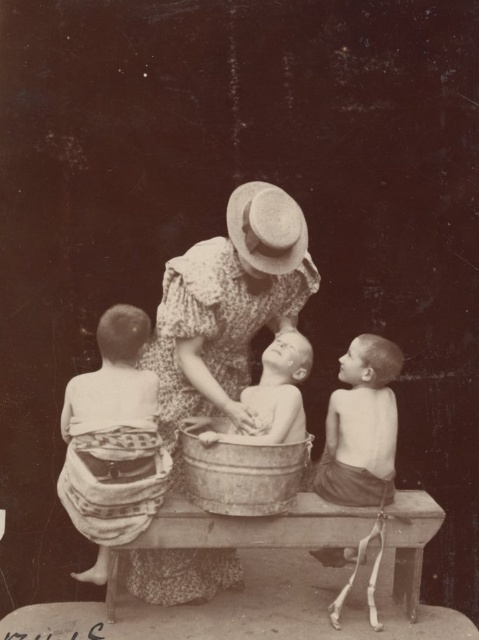
Question: Which point is farther from the camera taking this photo?

Choices:
 (A) (237, 243)
 (B) (254, 417)
 (C) (90, 476)

Answer: (A)

Question: Can you confirm if smooth skin boy at right is bigger than straw hat at center?

Choices:
 (A) no
 (B) yes

Answer: (B)

Question: Among these objects, which one is farthest from the camera?

Choices:
 (A) smooth skin boy at right
 (B) floral fabric dress at center

Answer: (A)

Question: Can you confirm if patterned fabric towel at left is smaller than straw hat at center?

Choices:
 (A) no
 (B) yes

Answer: (A)

Question: Which point appears closest to the camera in this image?

Choices:
 (A) [x=260, y=202]
 (B) [x=363, y=385]
 (C) [x=126, y=515]
 (D) [x=231, y=413]

Answer: (C)

Question: Is smooth skin boy at right wider than straw hat at center?

Choices:
 (A) yes
 (B) no

Answer: (A)